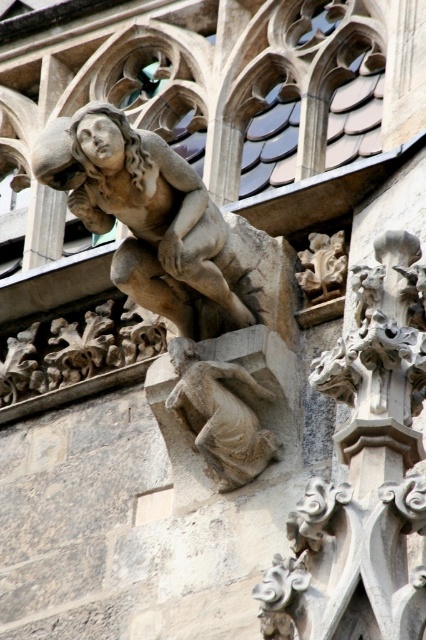
Question: Which point is closer to the camera?

Choices:
 (A) (278, 458)
 (B) (330, 246)

Answer: (A)

Question: Where is stone gargoyle at lower center located in relation to white stone gargoyle at upper right in the image?

Choices:
 (A) left
 (B) right

Answer: (A)

Question: Is stone gargoyle at lower center further to the viewer compared to white stone gargoyle at upper right?

Choices:
 (A) no
 (B) yes

Answer: (A)

Question: Considering the relative positions of stone gargoyle at lower center and white stone gargoyle at upper right in the image provided, where is stone gargoyle at lower center located with respect to white stone gargoyle at upper right?

Choices:
 (A) above
 (B) below

Answer: (B)

Question: Which point is farther to the camera?

Choices:
 (A) stone gargoyle at lower center
 (B) white stone gargoyle at upper right

Answer: (B)

Question: Among these objects, which one is nearest to the camera?

Choices:
 (A) white stone gargoyle at upper right
 (B) stone gargoyle at lower center

Answer: (B)